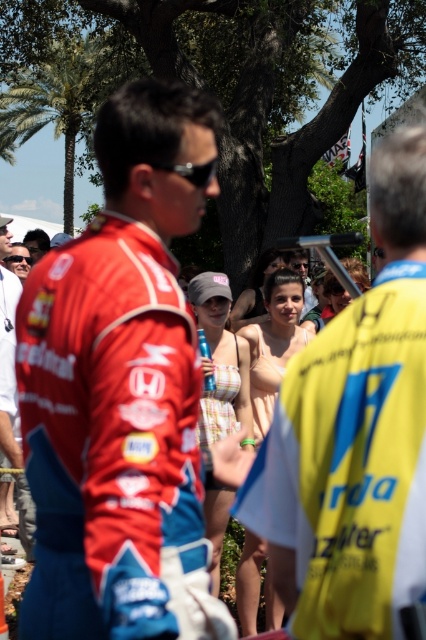
Question: Can you confirm if yellow fabric jersey at center is bigger than green leafy palm tree at upper left?

Choices:
 (A) no
 (B) yes

Answer: (A)

Question: Does yellow fabric jersey at center have a greater width compared to black matte sunglasses at center?

Choices:
 (A) no
 (B) yes

Answer: (B)

Question: Considering the real-world distances, which object is farthest from the matte black sunglasses at center?

Choices:
 (A) black matte sunglasses at center
 (B) yellow fabric jersey at center
 (C) green leafy palm tree at upper left

Answer: (C)

Question: Does green leafy palm tree at upper left appear on the left side of matte black sunglasses at center?

Choices:
 (A) yes
 (B) no

Answer: (A)

Question: Which object is closer to the camera taking this photo?

Choices:
 (A) green leafy palm tree at upper left
 (B) red fabric racing suit at center
 (C) black matte sunglasses at center
 (D) yellow fabric jersey at center

Answer: (D)

Question: Estimate the real-world distances between objects in this image. Which object is closer to the yellow fabric jersey at center?

Choices:
 (A) black matte sunglasses at center
 (B) red fabric racing suit at center

Answer: (B)